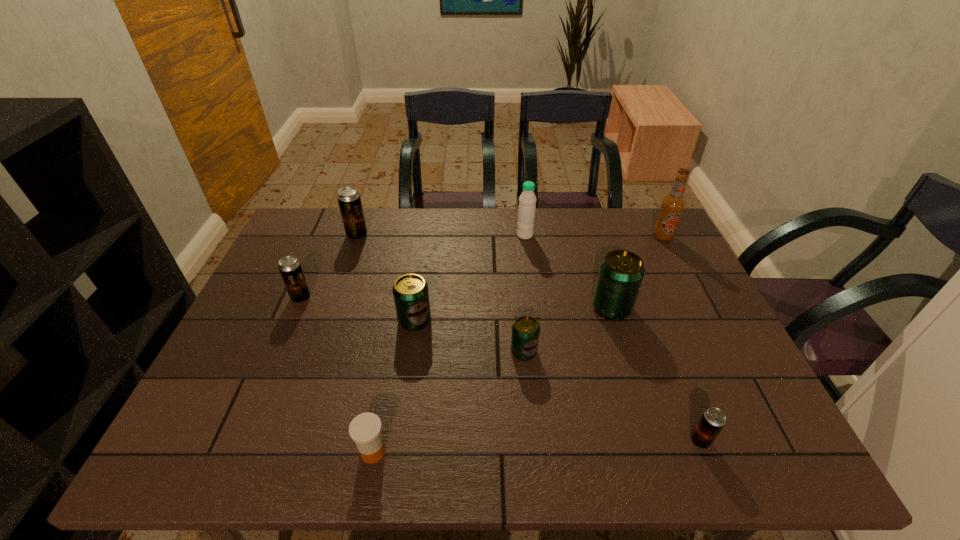
Select which object appears as the second closest to the leftmost green beer can. Please provide its 2D coordinates. Your answer should be formatted as a tuple, i.e. [(x, y)], where the tuple contains the x and y coordinates of a point satisfying the conditions above.

[(290, 268)]

Locate an element on the screen. This screenshot has width=960, height=540. object that is the third closest to the leftmost beer can is located at coordinates 365,429.

Locate an element on the screen. The width and height of the screenshot is (960, 540). the fifth closest beer can to the second object from left to right is located at coordinates (713, 419).

Identify which beer can is the second nearest to the eighth object from right to left. Please provide its 2D coordinates. Your answer should be formatted as a tuple, i.e. [(x, y)], where the tuple contains the x and y coordinates of a point satisfying the conditions above.

[(411, 296)]

At what (x,y) coordinates should I click in order to perform the action: click on black beer can that stands as the closest to the smallest black beer can. Please return your answer as a coordinate pair (x, y). The height and width of the screenshot is (540, 960). Looking at the image, I should click on (290, 268).

This screenshot has width=960, height=540. What are the coordinates of `black beer can that is the second closest to the leftmost black beer can` in the screenshot? It's located at (713, 419).

The width and height of the screenshot is (960, 540). Identify the location of the closest green beer can to the tallest object. (621, 272).

Locate which green beer can ranks in proximity to the leftmost green beer can. Please provide its 2D coordinates. Your answer should be formatted as a tuple, i.e. [(x, y)], where the tuple contains the x and y coordinates of a point satisfying the conditions above.

[(525, 330)]

Locate an element on the screen. The width and height of the screenshot is (960, 540). free region that satisfies the following two spatial constraints: 1. on the front label of the rightmost object; 2. on the label of the medicine is located at coordinates (772, 451).

The width and height of the screenshot is (960, 540). Find the location of `free space that satisfies the following two spatial constraints: 1. on the front side of the nearest black beer can; 2. on the left side of the water bottle`. free space that satisfies the following two spatial constraints: 1. on the front side of the nearest black beer can; 2. on the left side of the water bottle is located at coordinates (551, 441).